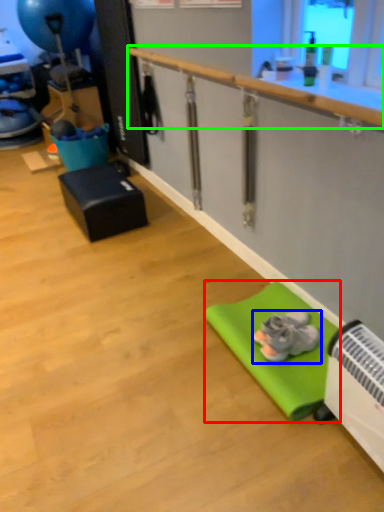
Question: Which object is positioned farthest from yoga mat (highlighted by a red box)? Select from footwear (highlighted by a blue box) and rail (highlighted by a green box).

Choices:
 (A) footwear
 (B) rail

Answer: (B)